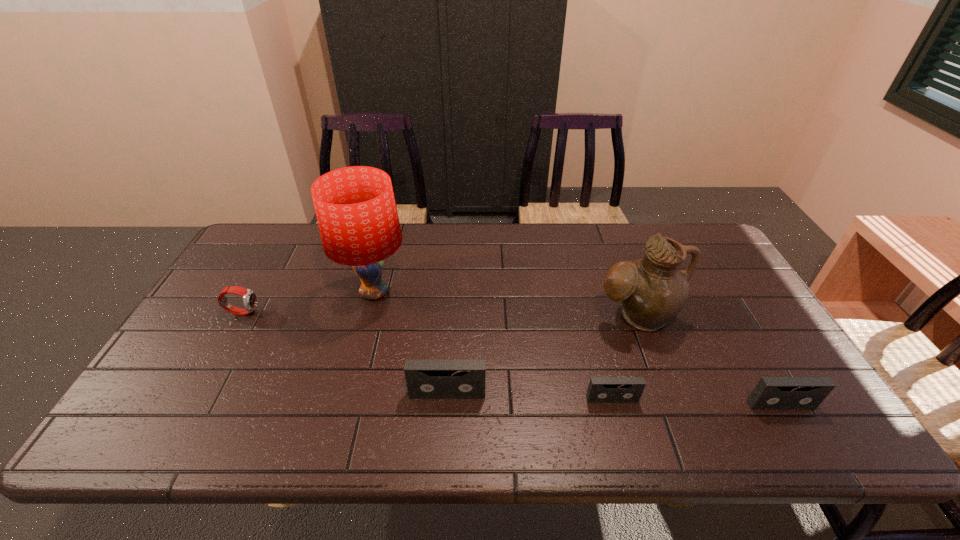
Please show where to add a videotape on the left while keeping spacing even. Please provide its 2D coordinates. Your answer should be formatted as a tuple, i.e. [(x, y)], where the tuple contains the x and y coordinates of a point satisfying the conditions above.

[(286, 388)]